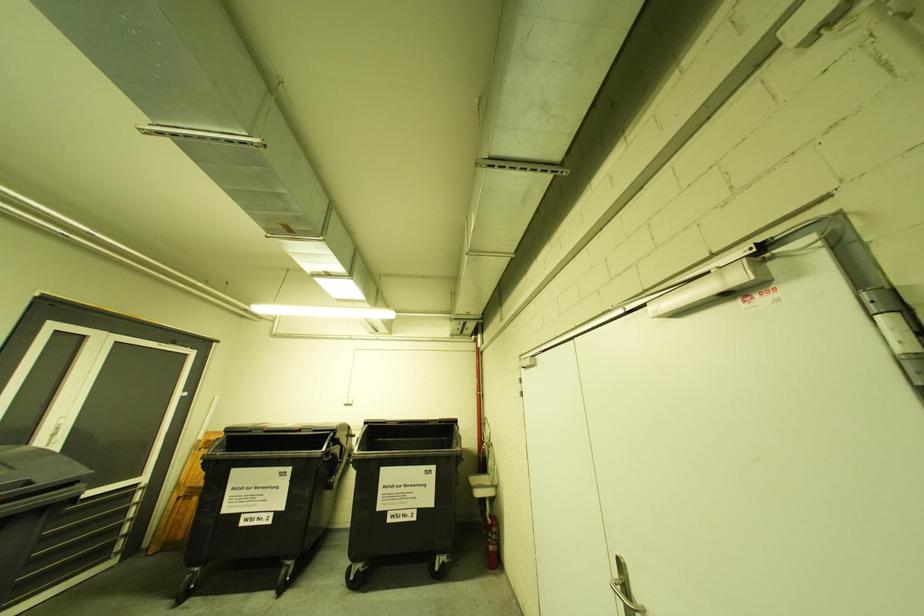
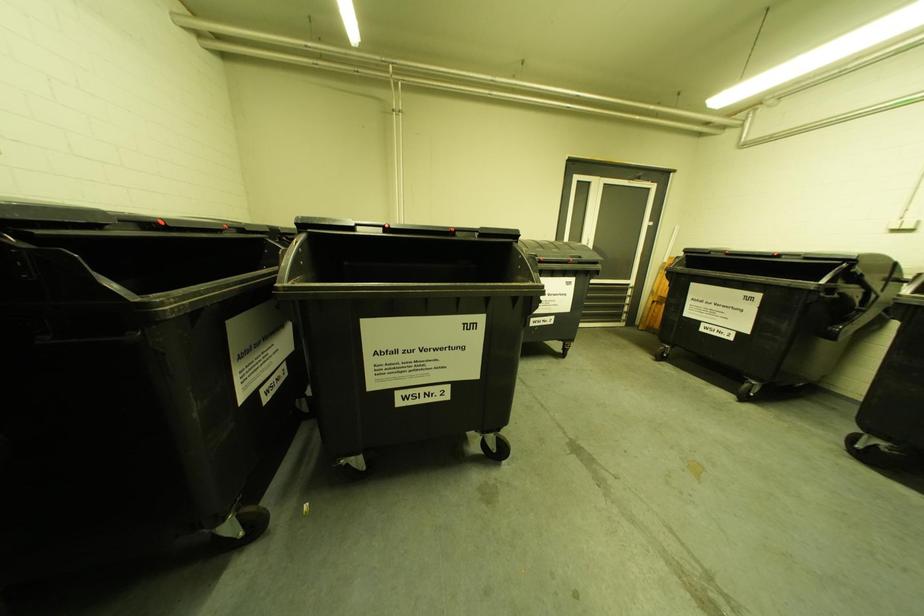
The first image is from the beginning of the video and the second image is from the end. How did the camera likely rotate when shooting the video?

The camera's rotation is toward left-down.